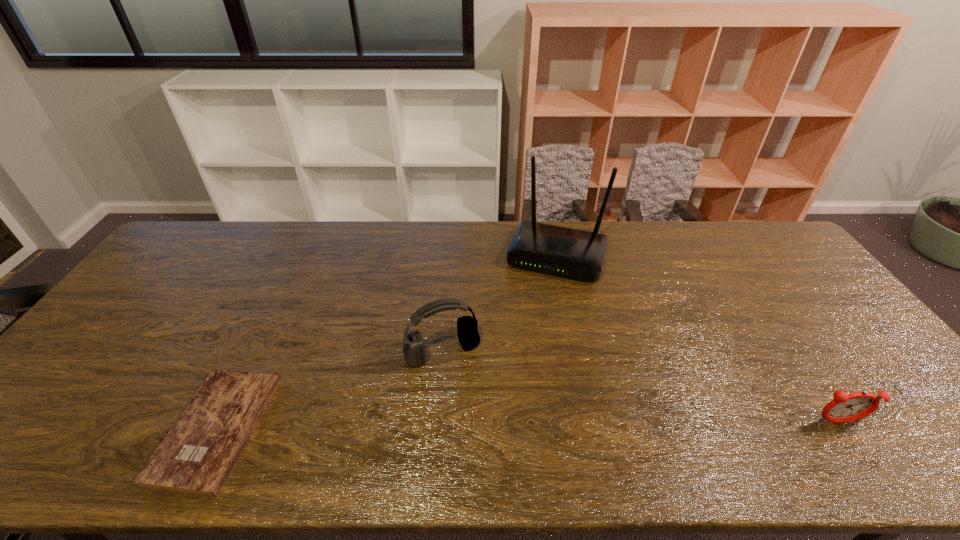
Image resolution: width=960 pixels, height=540 pixels. Find the location of `free region located 0.150m on the headband of the headset`. free region located 0.150m on the headband of the headset is located at coordinates (477, 416).

Where is `vacant space located 0.150m on the front-facing side of the third object from left to right`? Image resolution: width=960 pixels, height=540 pixels. vacant space located 0.150m on the front-facing side of the third object from left to right is located at coordinates point(535,317).

The height and width of the screenshot is (540, 960). In order to click on vacant space situated on the front-facing side of the third object from left to right in this screenshot , I will do `click(535, 317)`.

The height and width of the screenshot is (540, 960). Identify the location of vacant space situated on the front-facing side of the third object from left to right. (535, 317).

Find the location of a particular element. The height and width of the screenshot is (540, 960). object located in the far edge section of the desktop is located at coordinates (568, 252).

This screenshot has height=540, width=960. Find the location of `Bible positioned at the near edge`. Bible positioned at the near edge is located at coordinates (199, 452).

The width and height of the screenshot is (960, 540). I want to click on alarm clock that is at the near edge, so click(x=845, y=408).

At what (x,y) coordinates should I click in order to perform the action: click on blank area at the far edge. Please return your answer as a coordinate pair (x, y). The width and height of the screenshot is (960, 540). Looking at the image, I should click on (649, 256).

This screenshot has height=540, width=960. Find the location of `vacant space at the near edge of the desktop`. vacant space at the near edge of the desktop is located at coordinates (174, 404).

Where is `vacant space at the left edge of the desktop`? The width and height of the screenshot is (960, 540). vacant space at the left edge of the desktop is located at coordinates (170, 274).